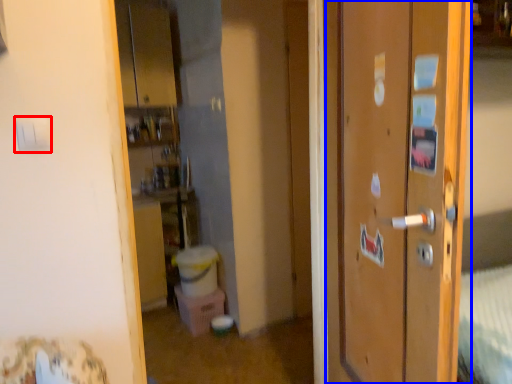
Question: Which of the following is the closest to the observer, light switch (highlighted by a red box) or door (highlighted by a blue box)?

Choices:
 (A) light switch
 (B) door

Answer: (B)